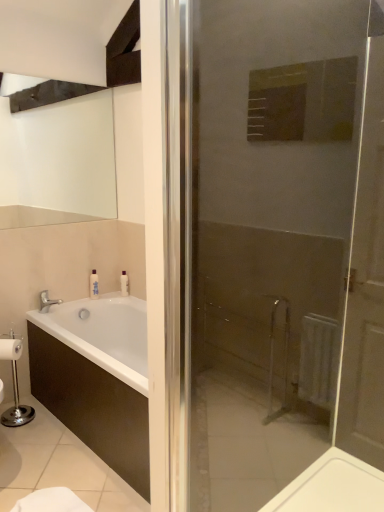
The image size is (384, 512). I want to click on free location to the right of white glossy bottle at upper left, so click(x=114, y=297).